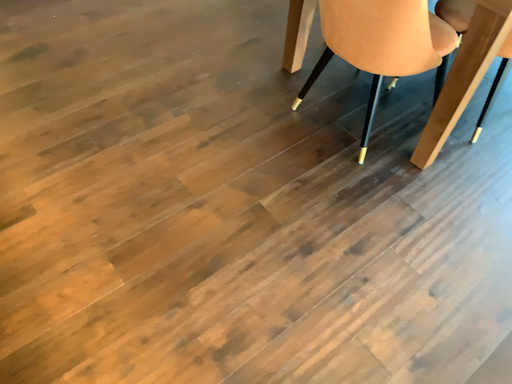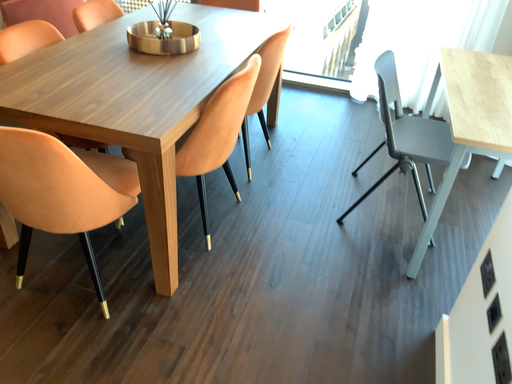
Question: Which way did the camera rotate in the video?

Choices:
 (A) rotated right
 (B) rotated left

Answer: (A)